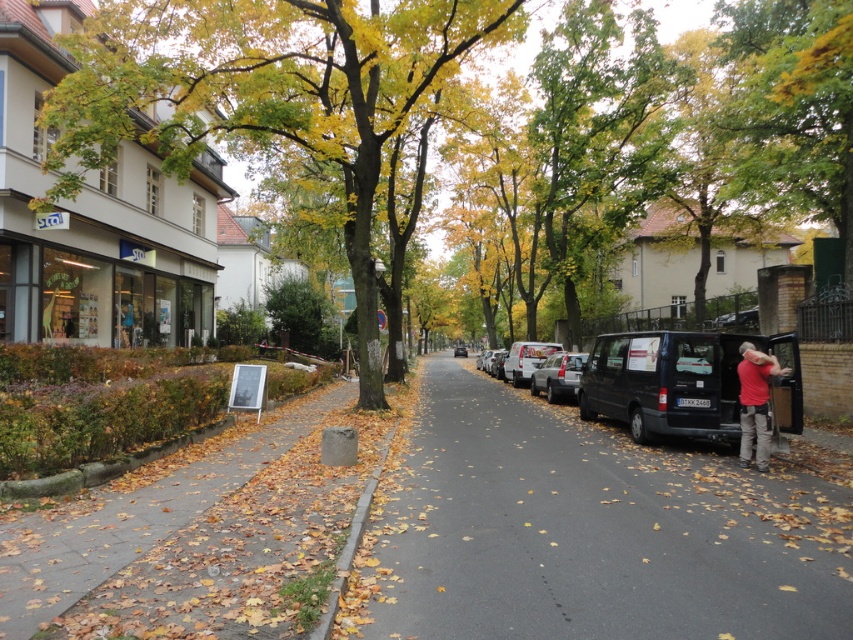
You are a delivery driver who needs to park your satin silver car at center as close as possible to the green leafy tree at left without blocking the sidewalk. According to the scene description, what is the minimum distance you can park the car from the tree?

The minimum distance you can park the satin silver car at center from the green leafy tree at left is 11.76 meters, as that is the closest they can be without blocking the sidewalk according to the scene description.

You are standing at the center of the street in the image. Looking towards the left side, you see a point marked at coordinates (270, 93). What object is located at that point?

The point at coordinates (270, 93) indicates a green leafy tree at the left side of the street.